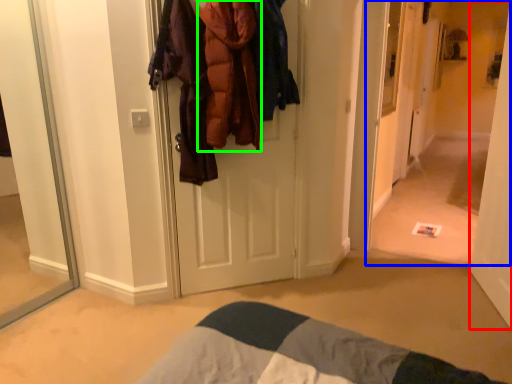
Question: Which is nearer to the door (highlighted by a red box)? corridor (highlighted by a blue box) or clothing (highlighted by a green box).

Choices:
 (A) corridor
 (B) clothing

Answer: (B)